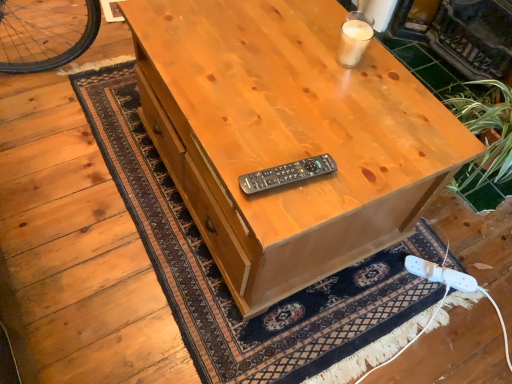
Where is `vacant space in front of white plastic game controller at lower right`? vacant space in front of white plastic game controller at lower right is located at coordinates (433, 310).